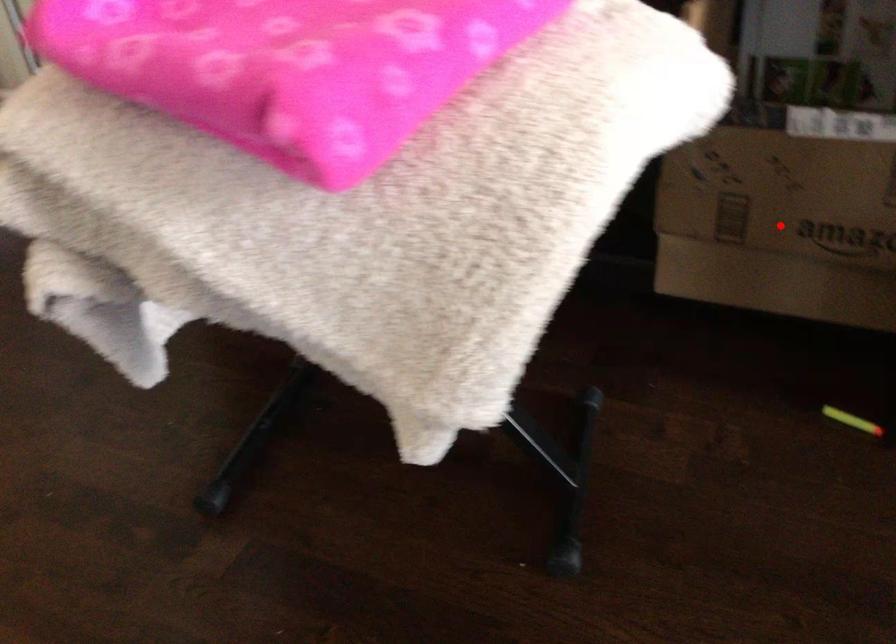
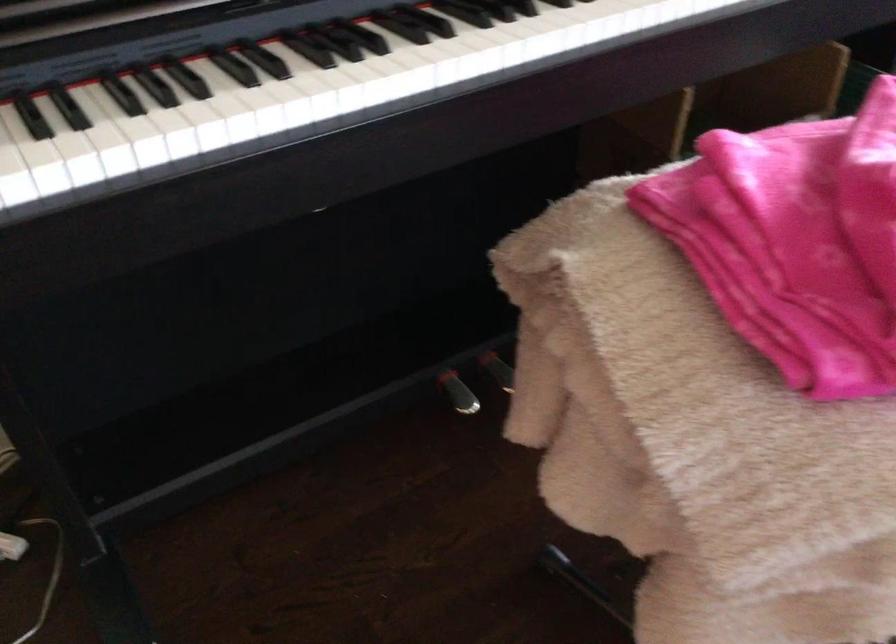
Question: I am providing you with two images of the same scene from different viewpoints. A red point is marked on the first image. At the location where the point appears in image 1, is it still visible in image 2?

Choices:
 (A) Yes
 (B) No

Answer: (B)